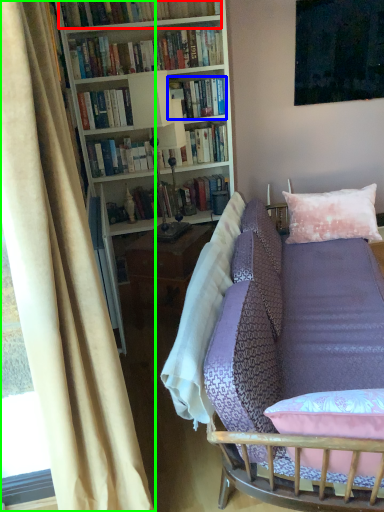
Question: Considering the real-world distances, which object is farthest from book (highlighted by a red box)? book (highlighted by a blue box) or curtain (highlighted by a green box)?

Choices:
 (A) book
 (B) curtain

Answer: (B)